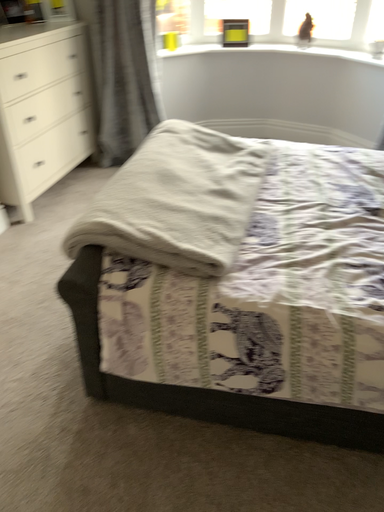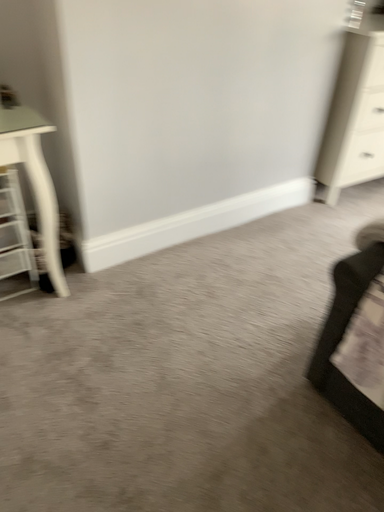
Question: Which way did the camera rotate in the video?

Choices:
 (A) rotated upward
 (B) rotated downward

Answer: (A)